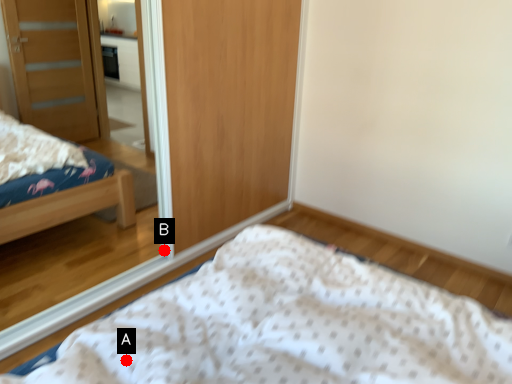
Question: Two points are circled on the image, labeled by A and B beside each circle. Which of the following is the farthest from the observer?

Choices:
 (A) A is further
 (B) B is further

Answer: (B)